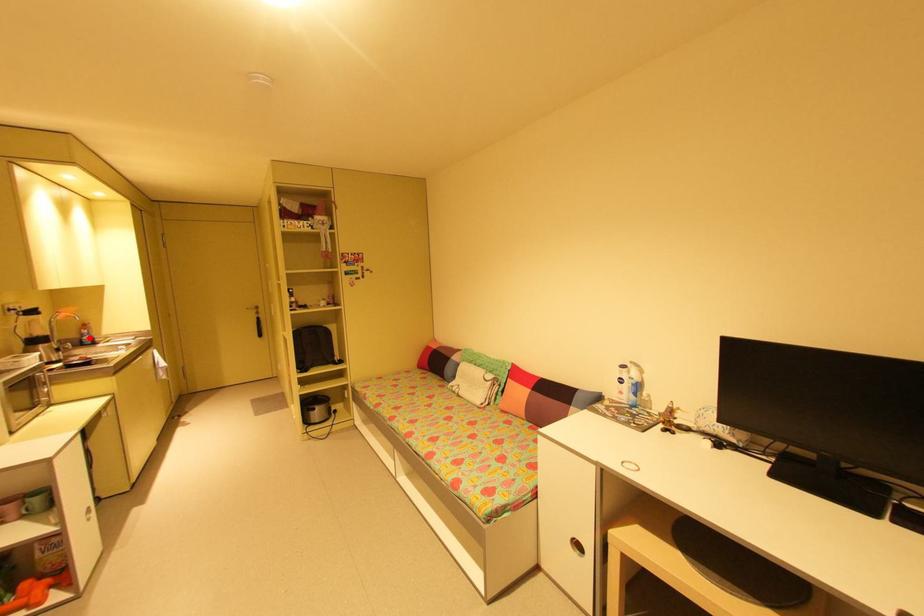
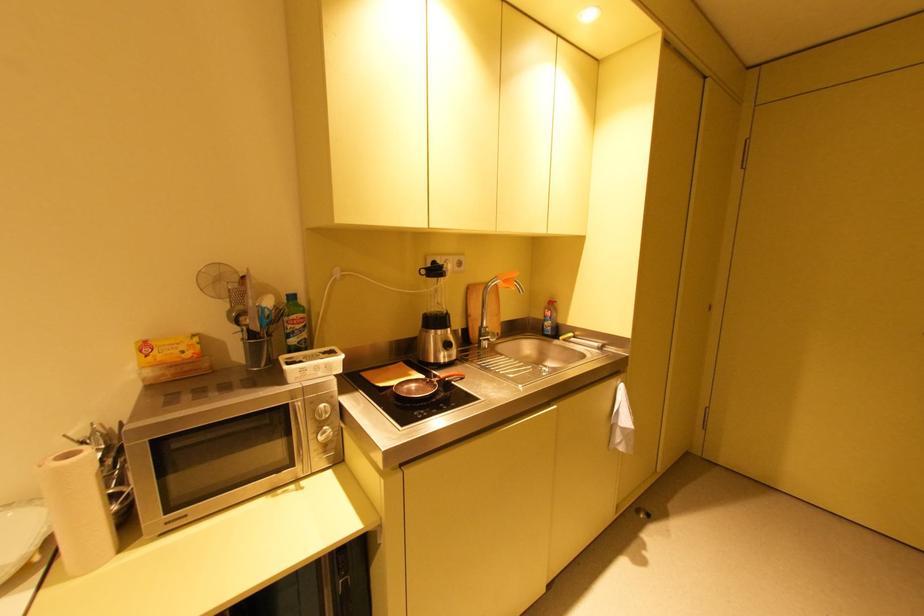
Question: I am providing you with two images of the same scene from different viewpoints. Given a red point in image1, look at the same physical point in image2. Is it:

Choices:
 (A) Closer to the viewpoint
 (B) Farther from the viewpoint

Answer: (A)